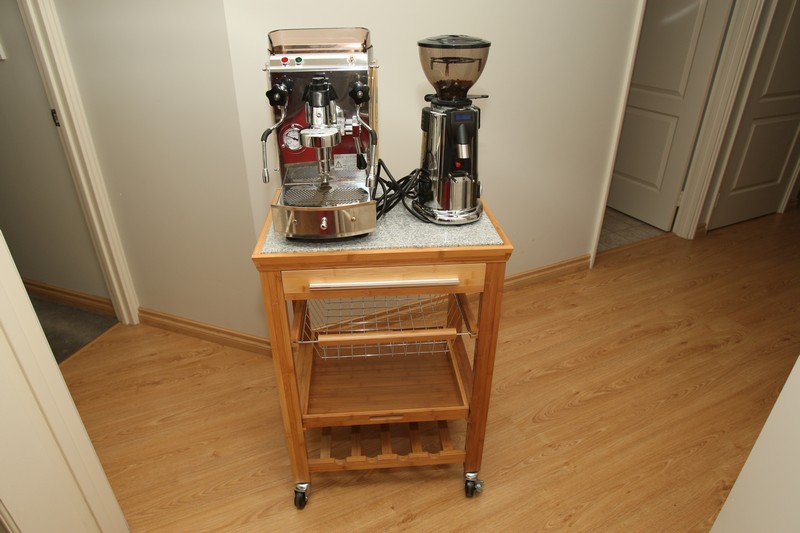
Locate an element on the screen. This screenshot has width=800, height=533. shelf is located at coordinates (344, 447).